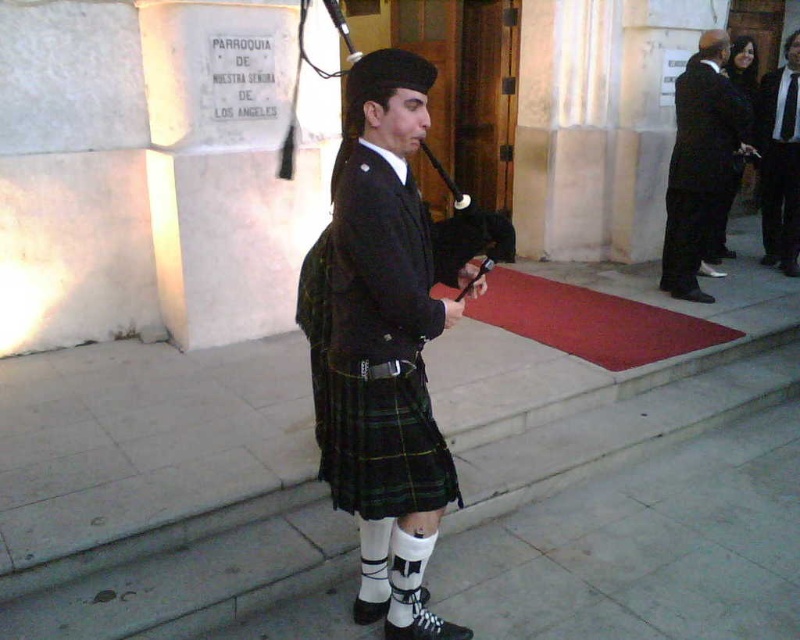
What is the spatial coordinate of the black woolen kilt at center in the image?

The black woolen kilt at center is located at the coordinate point of (377, 349).

You are a photographer trying to capture the person playing bagpipes. The person is standing at point (380, 438). To ensure the best lighting, you need to position yourself so that the sunlight hits the subject from the side. Given the scene description, where should you position yourself relative to the black plaid kilt at center?

The black plaid kilt at center is located at point (380, 438). To achieve side lighting, position yourself either to the left or right of this point, ensuring the sun is at a 90 degree angle relative to the subject.